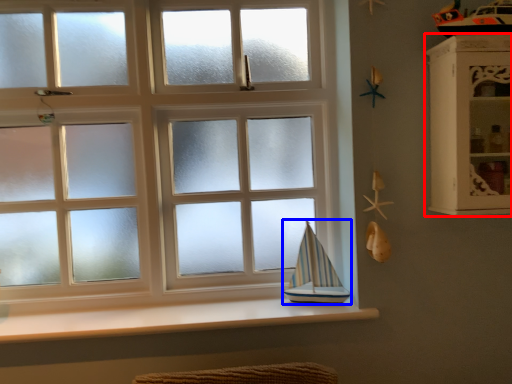
Question: Which object appears farthest to the camera in this image, shelf (highlighted by a red box) or sailboat (highlighted by a blue box)?

Choices:
 (A) shelf
 (B) sailboat

Answer: (B)